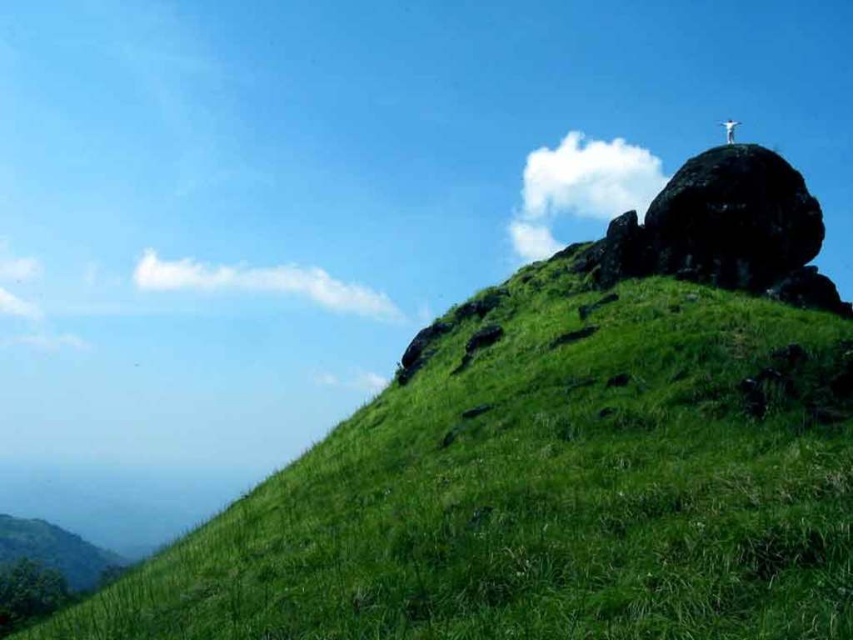
Question: Can you confirm if dark gray rocky outcrop at upper right is positioned to the right of white stone cross at upper right?

Choices:
 (A) yes
 (B) no

Answer: (B)

Question: Based on their relative distances, which object is farther from the green grassy hillside at upper right?

Choices:
 (A) white stone cross at upper right
 (B) dark gray rocky outcrop at upper right

Answer: (A)

Question: Does dark gray rocky outcrop at upper right appear over white stone cross at upper right?

Choices:
 (A) yes
 (B) no

Answer: (B)

Question: Which point is farther to the camera?

Choices:
 (A) white stone cross at upper right
 (B) green grassy hillside at upper right

Answer: (A)

Question: Is green grassy hillside at upper right positioned at the back of dark gray rocky outcrop at upper right?

Choices:
 (A) no
 (B) yes

Answer: (A)

Question: Which object is positioned closest to the white stone cross at upper right?

Choices:
 (A) dark gray rocky outcrop at upper right
 (B) green grassy hillside at upper right

Answer: (A)